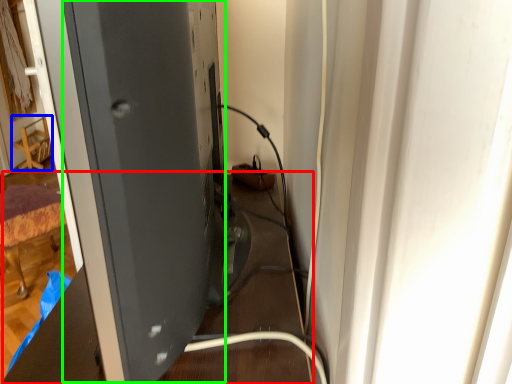
Question: Which is farther away from table (highlighted by a red box)? furniture (highlighted by a blue box) or wide (highlighted by a green box)?

Choices:
 (A) furniture
 (B) wide

Answer: (A)